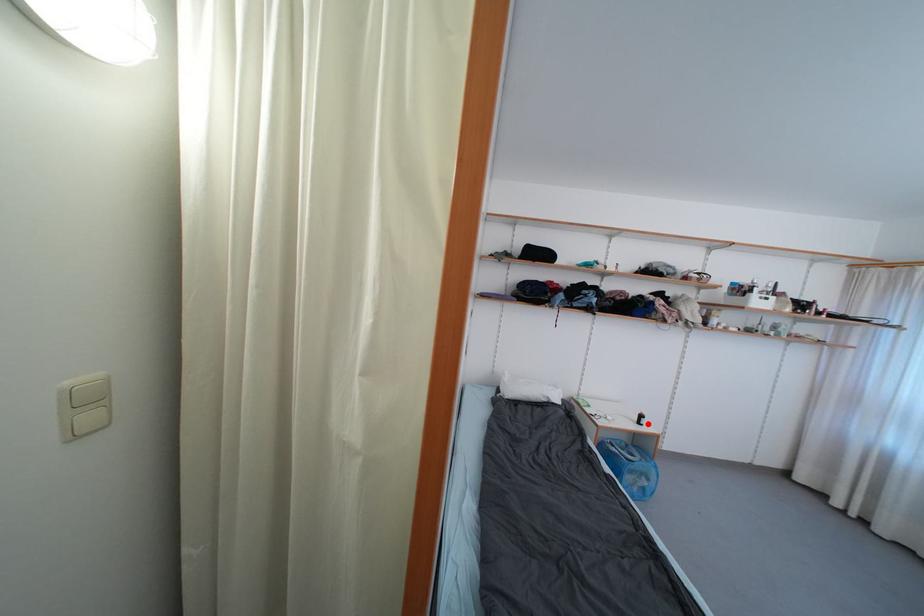
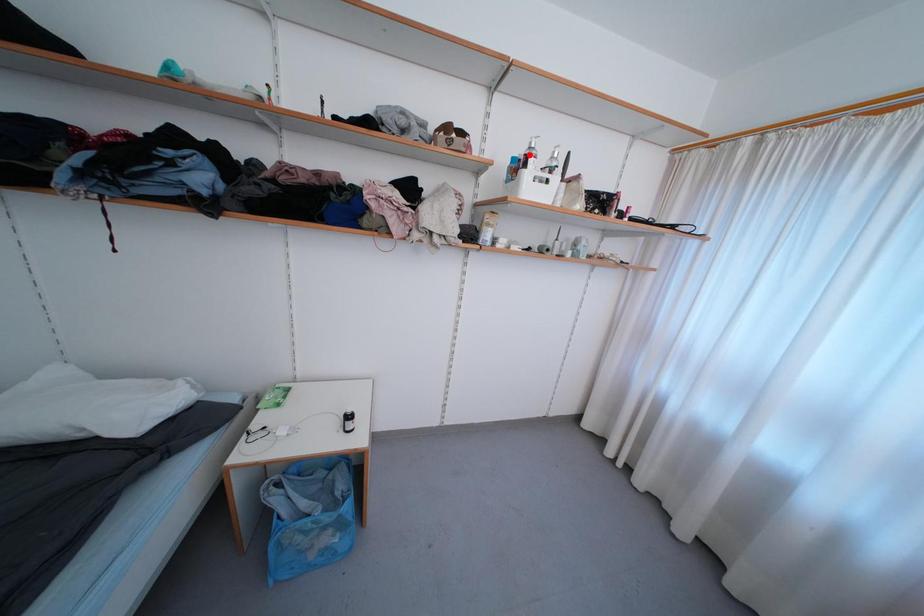
I am providing you with two images of the same scene from different viewpoints. A red point is marked on the first image and another point is marked on the second image. Is the marked point in image1 the same physical position as the marked point in image2?

No